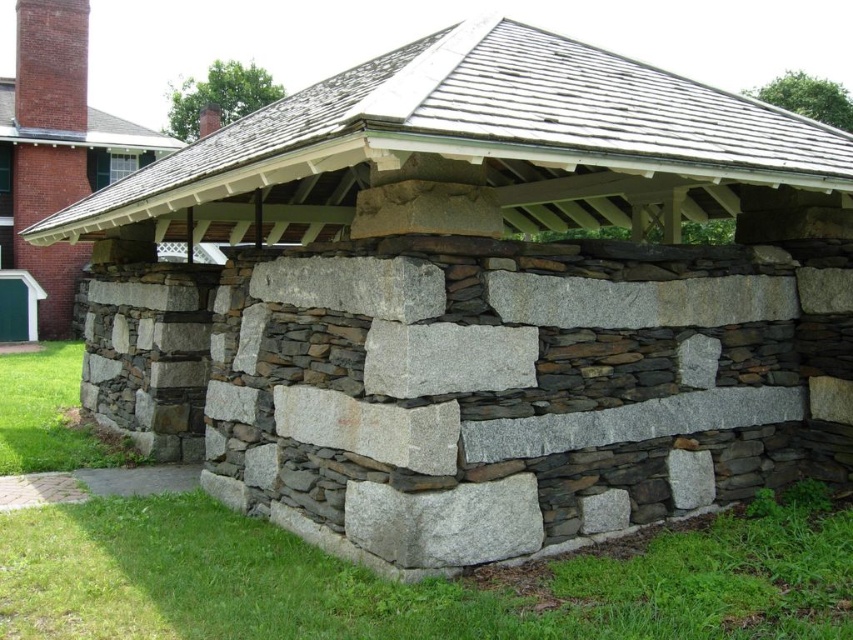
Question: From the image, what is the correct spatial relationship of gray stone wall at lower left in relation to green grass at lower center?

Choices:
 (A) above
 (B) below

Answer: (A)

Question: Is green grass at lower center smaller than natural stone wall at lower left?

Choices:
 (A) yes
 (B) no

Answer: (A)

Question: Which point is farther from the camera taking this photo?

Choices:
 (A) (662, 182)
 (B) (76, 548)
 (C) (144, 136)

Answer: (C)

Question: Which point is farther from the camera taking this photo?

Choices:
 (A) (735, 593)
 (B) (222, 172)

Answer: (B)

Question: Is gray stone wall at lower left smaller than green grass at lower center?

Choices:
 (A) no
 (B) yes

Answer: (A)

Question: Which point is farther to the camera?

Choices:
 (A) natural stone wall at lower left
 (B) gray stone wall at lower left
 (C) green grass at lower center

Answer: (A)